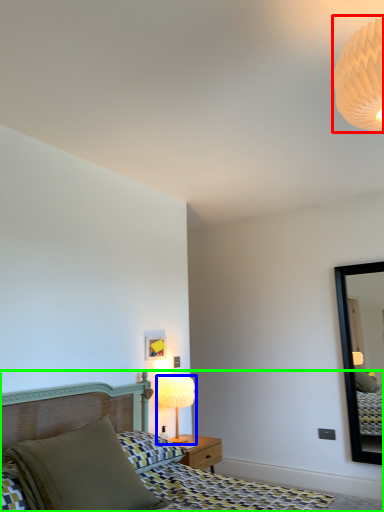
Question: Estimate the real-world distances between objects in this image. Which object is farther from lamp (highlighted by a red box), table lamp (highlighted by a blue box) or bed (highlighted by a green box)?

Choices:
 (A) table lamp
 (B) bed

Answer: (A)